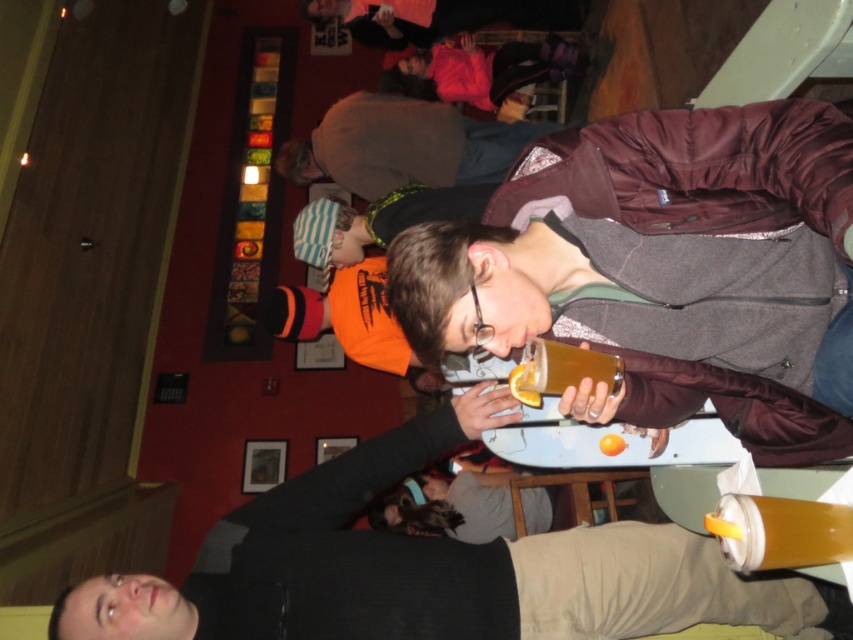
You are at a social event and want to choose a drink. You see a translucent plastic cup at lower right and a translucent plastic cup at upper center. Which one takes up more space?

The translucent plastic cup at upper center takes up more space than the translucent plastic cup at lower right.

You are at a social event and want to choose a cup for your drink. You prefer a wider cup for easier sipping. Based on the scene, which cup should you choose between the translucent plastic cup at lower right and the translucent plastic cup at upper center?

The translucent plastic cup at lower right might be wider than the translucent plastic cup at upper center, so you should choose the one at lower right for easier sipping.